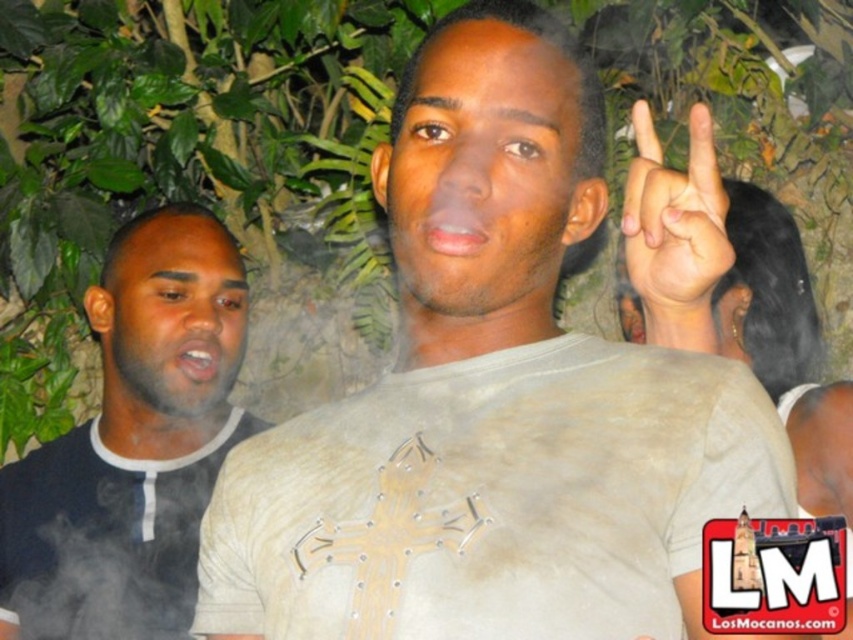
Question: Which point is farther from the camera taking this photo?

Choices:
 (A) (120, 628)
 (B) (701, 305)
 (C) (242, 554)

Answer: (A)

Question: Which object is closer to the camera taking this photo?

Choices:
 (A) black matte shirt at left
 (B) white matte shirt at center

Answer: (B)

Question: Can you confirm if black matte shirt at left is thinner than white matte hand at upper center?

Choices:
 (A) no
 (B) yes

Answer: (A)

Question: Does white matte shirt at center have a greater width compared to black matte shirt at left?

Choices:
 (A) yes
 (B) no

Answer: (A)

Question: Which object appears closest to the camera in this image?

Choices:
 (A) white matte hand at upper center
 (B) black matte shirt at left
 (C) white matte shirt at center

Answer: (C)

Question: Is black matte shirt at left thinner than white matte hand at upper center?

Choices:
 (A) yes
 (B) no

Answer: (B)